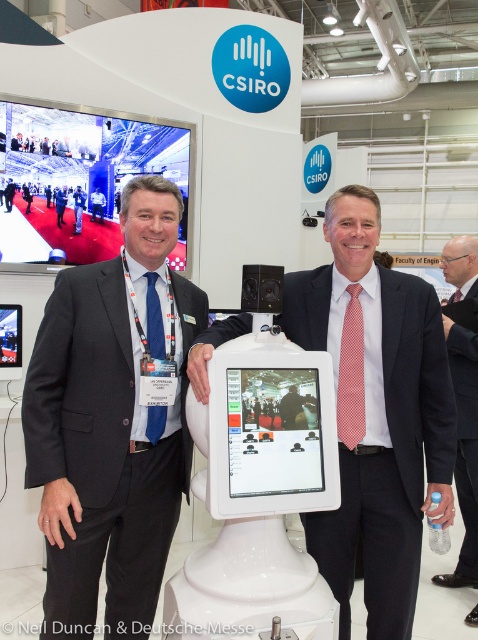
Can you confirm if pink textured tie at center is wider than blue suit at center?

Correct, the width of pink textured tie at center exceeds that of blue suit at center.

Identify the location of pink textured tie at center. This screenshot has height=640, width=478. click(x=376, y=412).

Does matte black suit at center come in front of blue tie suit at center?

Yes, matte black suit at center is closer to the viewer.

Is matte black suit at center positioned at the back of blue tie suit at center?

No, matte black suit at center is in front of blue tie suit at center.

Does point (158, 348) come closer to viewer compared to point (14, 188)?

Yes, point (158, 348) is closer to viewer.

The width and height of the screenshot is (478, 640). I want to click on matte black suit at center, so click(x=104, y=452).

Which is behind, point (76, 216) or point (57, 212)?

Positioned behind is point (76, 216).

Is blue tie at left thinner than blue suit at center?

No, blue tie at left is not thinner than blue suit at center.

Which is in front, point (74, 192) or point (58, 189)?

Point (58, 189)

At what (x,y) coordinates should I click in order to perform the action: click on blue tie at left. Please return your answer as a coordinate pair (x, y). The height and width of the screenshot is (640, 478). Looking at the image, I should click on [78, 208].